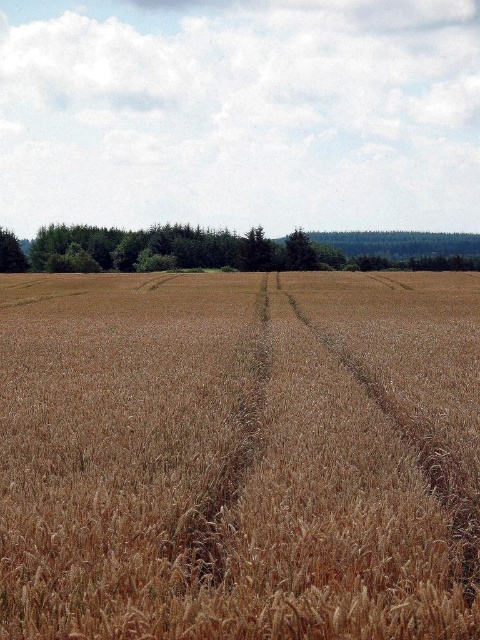
Does green leafy trees at center come in front of green leafy tree at left?

That is False.

Between green leafy trees at center and green leafy tree at left, which one appears on the left side from the viewer's perspective?

From the viewer's perspective, green leafy tree at left appears more on the left side.

Who is more forward, (51, 230) or (21, 250)?

Point (21, 250) is more forward.

At what (x,y) coordinates should I click in order to perform the action: click on green leafy trees at center. Please return your answer as a coordinate pair (x, y). Image resolution: width=480 pixels, height=640 pixels. Looking at the image, I should click on (233, 250).

Describe the element at coordinates (300, 252) in the screenshot. I see `green matte tree at center` at that location.

Between green matte tree at center and green leafy tree at left, which one is positioned higher?

green leafy tree at left

Measure the distance between green matte tree at center and camera.

green matte tree at center and camera are 91.95 meters apart from each other.

The width and height of the screenshot is (480, 640). In order to click on green matte tree at center in this screenshot , I will do `click(300, 252)`.

Between point (16, 285) and point (288, 268), which one is positioned in front?

Point (16, 285) is in front.

Which is more to the right, golden wheat field at center or green matte tree at center?

From the viewer's perspective, green matte tree at center appears more on the right side.

The height and width of the screenshot is (640, 480). Identify the location of golden wheat field at center. (240, 456).